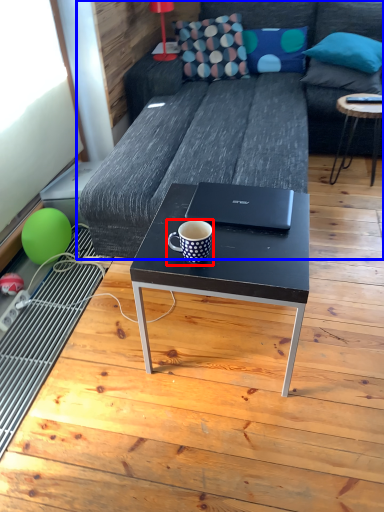
Question: Which of the following is the farthest to the observer, coffee cup (highlighted by a red box) or studio couch (highlighted by a blue box)?

Choices:
 (A) coffee cup
 (B) studio couch

Answer: (B)